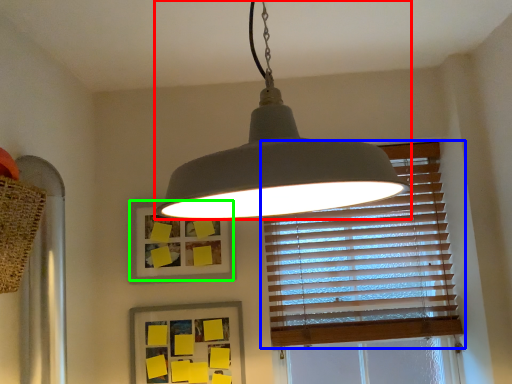
Question: Considering the real-world distances, which object is farthest from lamp (highlighted by a red box)? window blind (highlighted by a blue box) or picture frame (highlighted by a green box)?

Choices:
 (A) window blind
 (B) picture frame

Answer: (A)